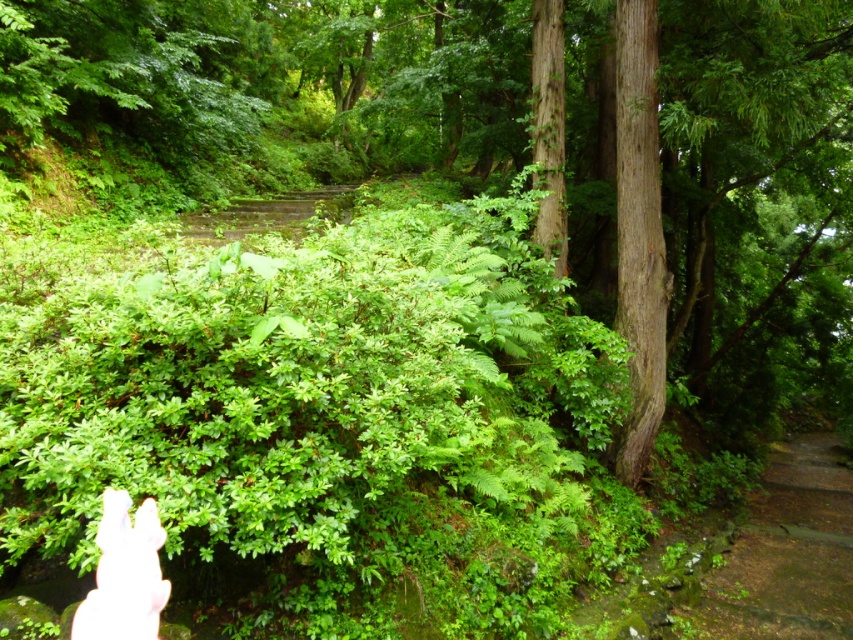
Can you confirm if brown dirt stairs at lower right is smaller than white flesh at lower left?

No.

Which of these two, brown dirt stairs at lower right or white flesh at lower left, stands taller?

Standing taller between the two is brown dirt stairs at lower right.

Between point (730, 589) and point (151, 579), which one is positioned in front?

Point (151, 579) is more forward.

Where is `brown dirt stairs at lower right`? The image size is (853, 640). brown dirt stairs at lower right is located at coordinates (787, 552).

Does smooth brown tree trunk at right have a smaller size compared to white flesh at lower left?

No, smooth brown tree trunk at right is not smaller than white flesh at lower left.

Consider the image. Is smooth brown tree trunk at right to the left of white flesh at lower left from the viewer's perspective?

No, smooth brown tree trunk at right is not to the left of white flesh at lower left.

Does point (653, 308) lie behind point (149, 515)?

Yes, it is behind point (149, 515).

You are a GUI agent. You are given a task and a screenshot of the screen. Output one action in this format:
    pyautogui.click(x=<x>, y=<y>)
    Task: Click on the smooth brown tree trunk at right
    Image resolution: width=853 pixels, height=640 pixels.
    Given the screenshot: What is the action you would take?
    pos(639,234)

Measure the distance between brown dirt stairs at lower right and camera.

The distance of brown dirt stairs at lower right from camera is 5.69 meters.

Can you confirm if brown dirt stairs at lower right is positioned above smooth brown tree trunk at right?

No.

The width and height of the screenshot is (853, 640). What do you see at coordinates (787, 552) in the screenshot?
I see `brown dirt stairs at lower right` at bounding box center [787, 552].

Find the location of a particular element. The height and width of the screenshot is (640, 853). brown dirt stairs at lower right is located at coordinates (787, 552).